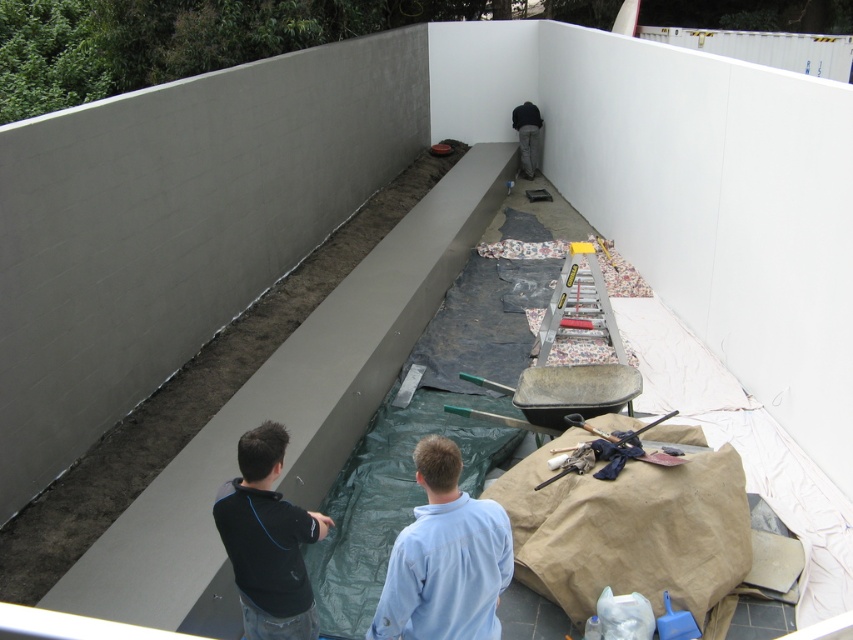
Between light blue shirt at center and dark gray pants at center, which one appears on the left side from the viewer's perspective?

From the viewer's perspective, light blue shirt at center appears more on the left side.

Is point (424, 541) positioned after point (520, 163)?

That is False.

Identify the location of light blue shirt at center. The height and width of the screenshot is (640, 853). point(445,557).

Can you confirm if light blue shirt at center is thinner than black matte shirt at lower left?

Incorrect, light blue shirt at center's width is not less than black matte shirt at lower left's.

Can you confirm if light blue shirt at center is positioned to the right of black matte shirt at lower left?

Indeed, light blue shirt at center is positioned on the right side of black matte shirt at lower left.

You are a GUI agent. You are given a task and a screenshot of the screen. Output one action in this format:
    pyautogui.click(x=<x>, y=<y>)
    Task: Click on the light blue shirt at center
    The height and width of the screenshot is (640, 853).
    Given the screenshot: What is the action you would take?
    pyautogui.click(x=445, y=557)

Describe the element at coordinates (267, 540) in the screenshot. I see `black matte shirt at lower left` at that location.

Consider the image. Can you confirm if black matte shirt at lower left is positioned above dark gray pants at center?

No, black matte shirt at lower left is not above dark gray pants at center.

The width and height of the screenshot is (853, 640). Find the location of `black matte shirt at lower left`. black matte shirt at lower left is located at coordinates (267, 540).